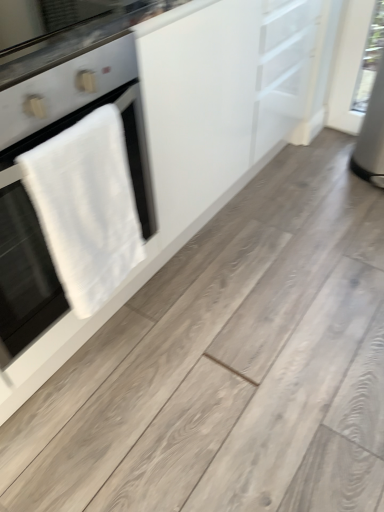
Question: Does white towel at left have a greater width compared to black glass countertop at upper left?

Choices:
 (A) no
 (B) yes

Answer: (B)

Question: Is white towel at left oriented towards black glass countertop at upper left?

Choices:
 (A) no
 (B) yes

Answer: (A)

Question: Is white towel at left next to black glass countertop at upper left?

Choices:
 (A) no
 (B) yes

Answer: (A)

Question: Considering the relative positions of white towel at left and black glass countertop at upper left in the image provided, is white towel at left to the left of black glass countertop at upper left from the viewer's perspective?

Choices:
 (A) no
 (B) yes

Answer: (B)

Question: Is white towel at left oriented away from black glass countertop at upper left?

Choices:
 (A) no
 (B) yes

Answer: (A)

Question: Are white towel at left and black glass countertop at upper left far apart?

Choices:
 (A) yes
 (B) no

Answer: (B)

Question: Does black glass countertop at upper left appear on the right side of white towel at left?

Choices:
 (A) yes
 (B) no

Answer: (A)

Question: Can you confirm if black glass countertop at upper left is smaller than white towel at left?

Choices:
 (A) yes
 (B) no

Answer: (A)

Question: Is black glass countertop at upper left wider than white towel at left?

Choices:
 (A) no
 (B) yes

Answer: (A)

Question: From the image's perspective, would you say black glass countertop at upper left is shown under white towel at left?

Choices:
 (A) no
 (B) yes

Answer: (A)

Question: Is black glass countertop at upper left next to white towel at left and touching it?

Choices:
 (A) yes
 (B) no

Answer: (B)

Question: Is black glass countertop at upper left not near white towel at left?

Choices:
 (A) yes
 (B) no

Answer: (B)

Question: Is black glass countertop at upper left at the back of white matte cabinet at upper left?

Choices:
 (A) no
 (B) yes

Answer: (A)